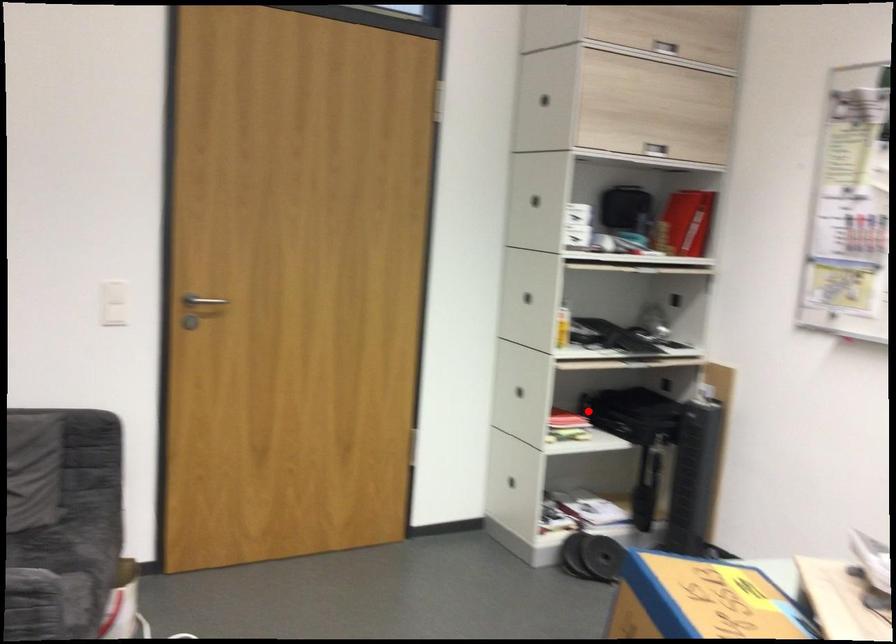
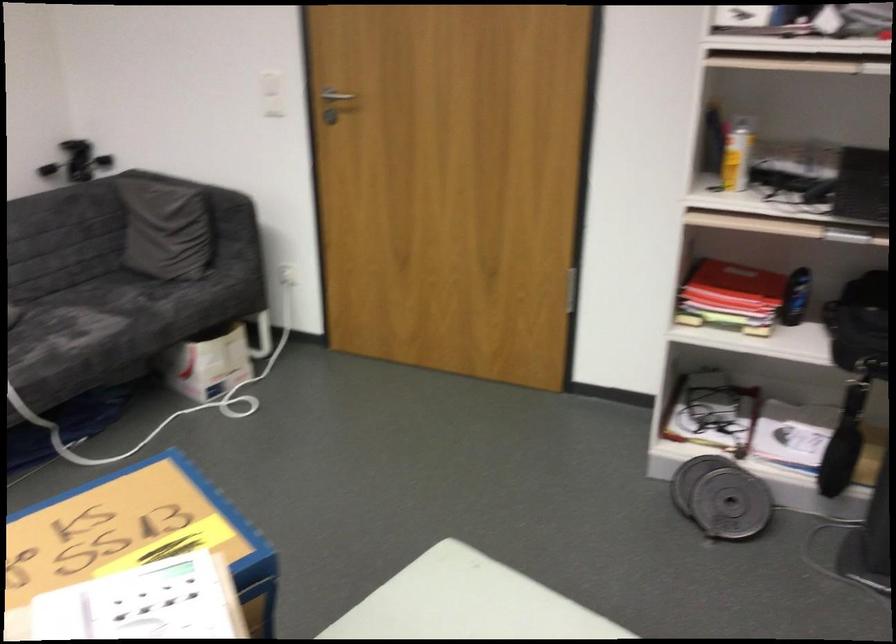
Question: I am providing you with two images of the same scene from different viewpoints. Image1 has a red point marked. In image2, the corresponding 3D location appears at what relative position? Reply with the corresponding letter.

Choices:
 (A) Closer
 (B) Farther

Answer: (A)